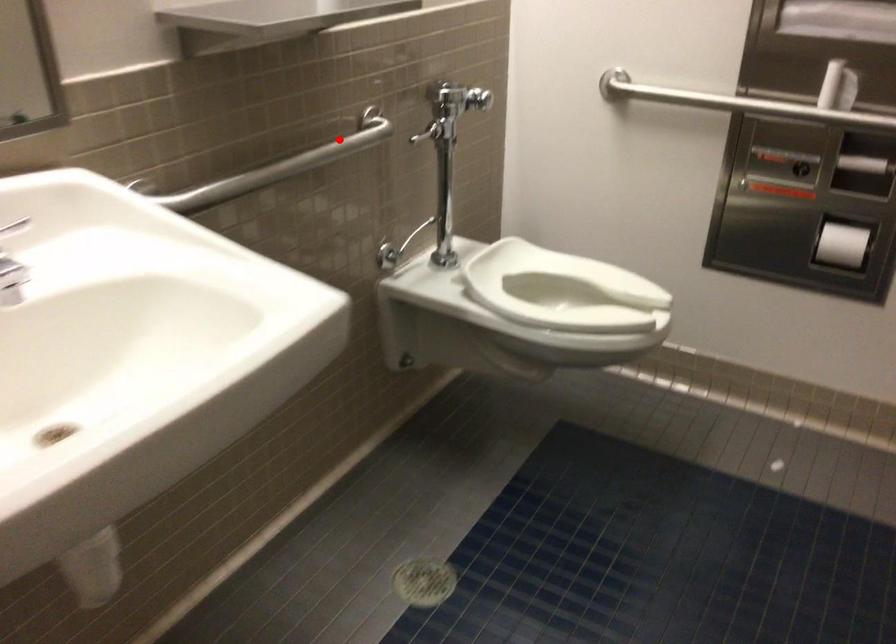
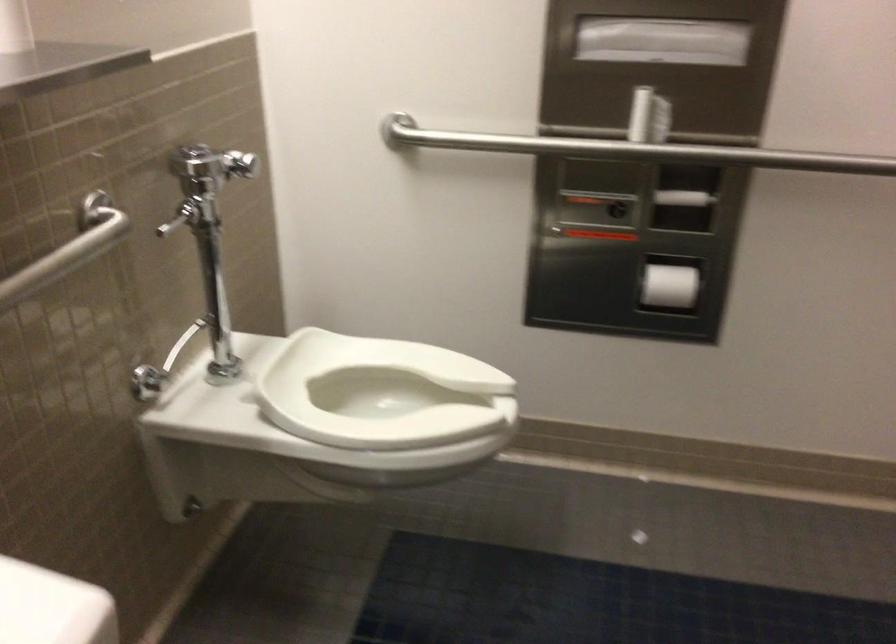
Question: I am providing you with two images of the same scene from different viewpoints. Image1 has a red point marked. In image2, the corresponding 3D location appears at what relative position? Reply with the corresponding letter.

Choices:
 (A) Closer
 (B) Farther

Answer: (A)